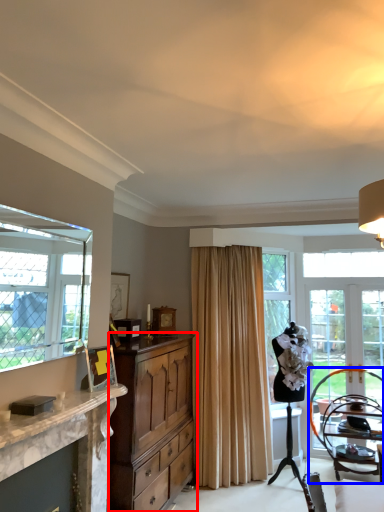
Question: Which object appears closest to the camera in this image, cabinetry (highlighted by a red box) or chair (highlighted by a blue box)?

Choices:
 (A) cabinetry
 (B) chair

Answer: (A)